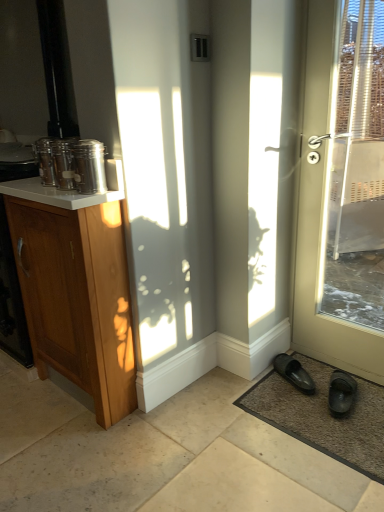
You are a GUI agent. You are given a task and a screenshot of the screen. Output one action in this format:
    pyautogui.click(x=<x>, y=<y>)
    Task: Click on the empty space that is to the right of black rubber slippers at lower right, marked as the second footwear in a left-to-right arrangement
    Image resolution: width=384 pixels, height=512 pixels.
    Given the screenshot: What is the action you would take?
    pyautogui.click(x=371, y=397)